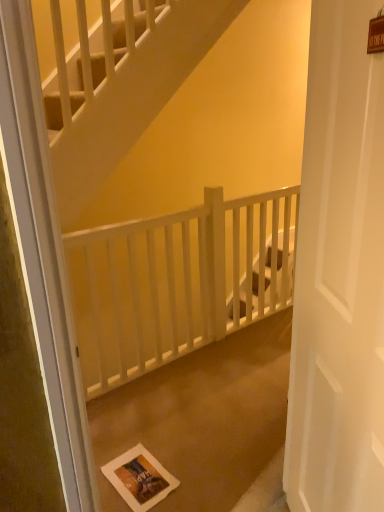
You are a GUI agent. You are given a task and a screenshot of the screen. Output one action in this format:
    pyautogui.click(x=<x>, y=<y>)
    Task: Click on the free point above white paper bag at center (from a real-world perspective)
    The image size is (384, 512).
    Given the screenshot: What is the action you would take?
    tap(213, 407)